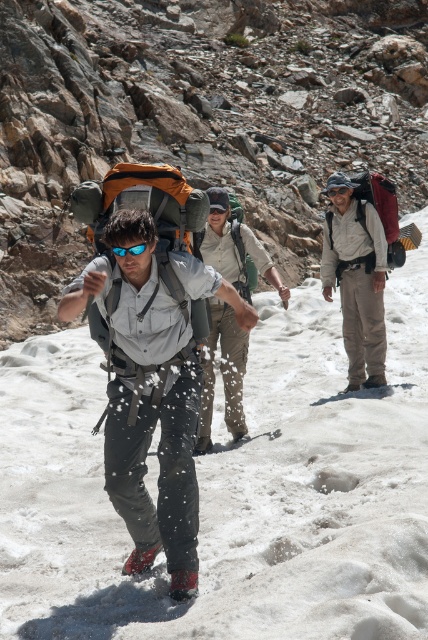
Question: Does matte gray jacket at center appear on the right side of blue reflective goggles at center?

Choices:
 (A) yes
 (B) no

Answer: (A)

Question: Is rough stone hillside at upper left further to camera compared to blue reflective goggles at center?

Choices:
 (A) yes
 (B) no

Answer: (A)

Question: Which of the following is the farthest from the observer?

Choices:
 (A) (214, 248)
 (B) (136, 252)

Answer: (A)

Question: Estimate the real-world distances between objects in this image. Which object is farther from the matte gray shirt at center?

Choices:
 (A) rough stone hillside at upper left
 (B) blue reflective lens at center
 (C) matte gray jacket at center

Answer: (A)

Question: Does matte gray jacket at center appear on the left side of blue reflective goggles at center?

Choices:
 (A) yes
 (B) no

Answer: (B)

Question: Which point is closer to the camera taking this photo?

Choices:
 (A) (145, 396)
 (B) (41, 134)
 (C) (344, 188)

Answer: (A)